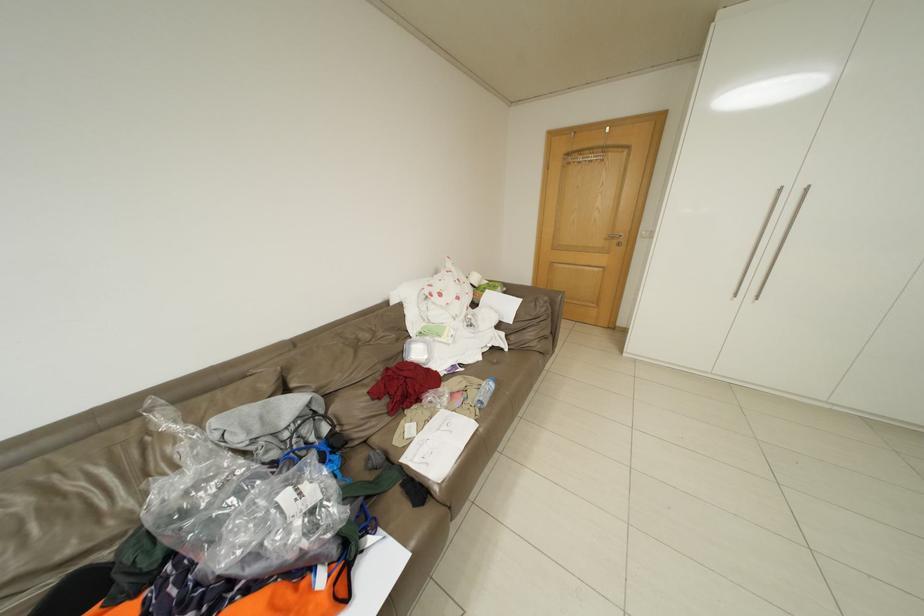
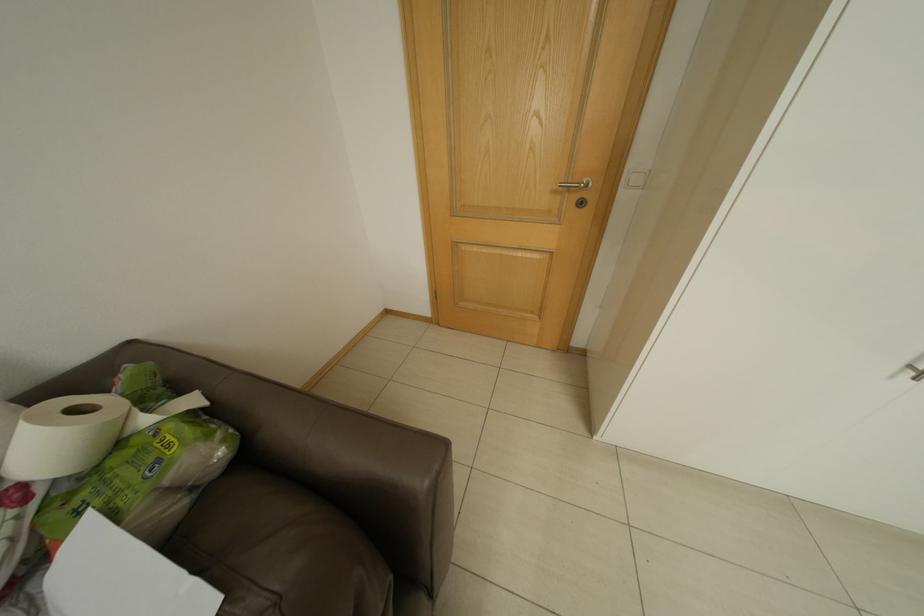
In a continuous first-person perspective shot, in which direction is the camera moving?

The movement direction of the cameraman is right, forward.